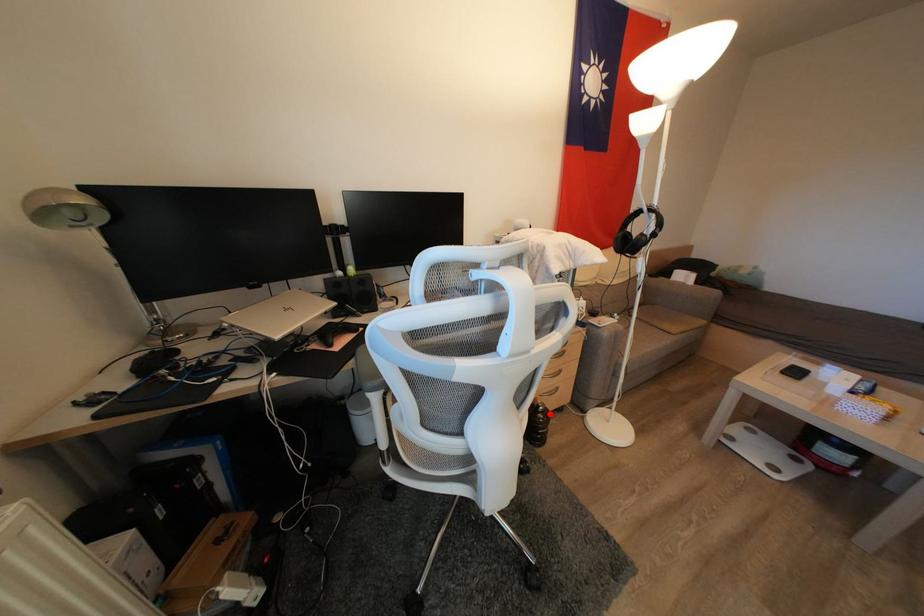
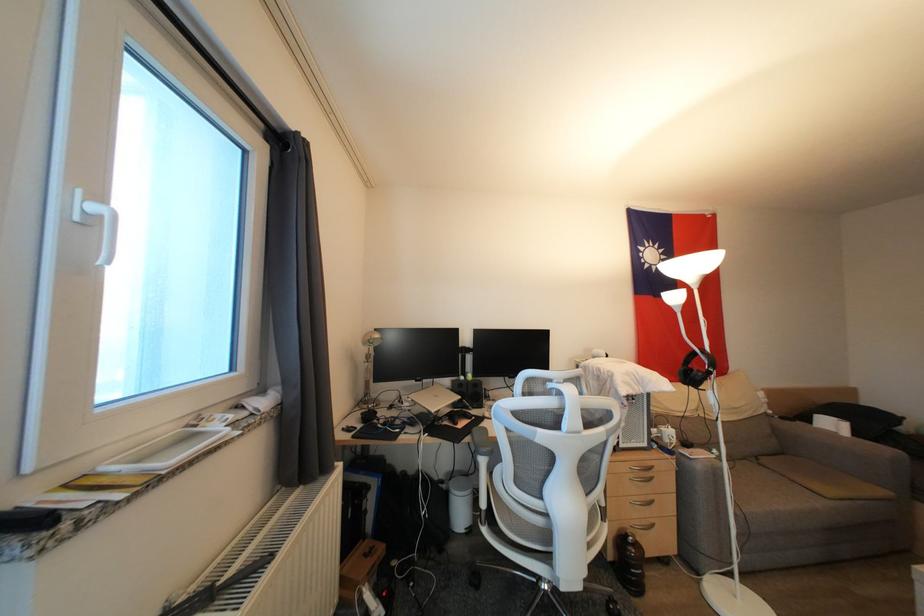
Question: I am providing you with two images of the same scene from different viewpoints. Given a red point in image1, look at the same physical point in image2. Is it:

Choices:
 (A) Closer to the viewpoint
 (B) Farther from the viewpoint

Answer: (A)